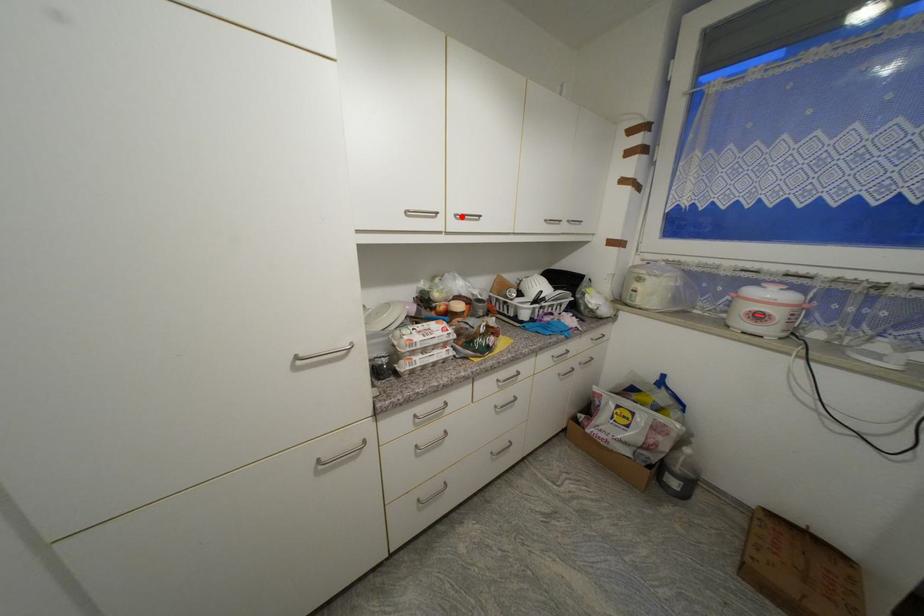
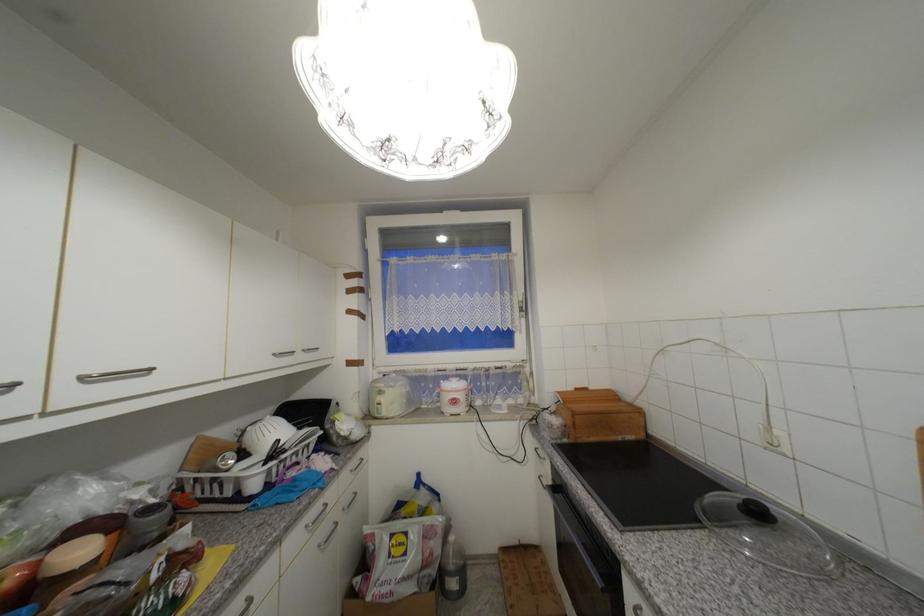
Find the pixel in the second image that matches the highlighted location in the first image.

(89, 379)